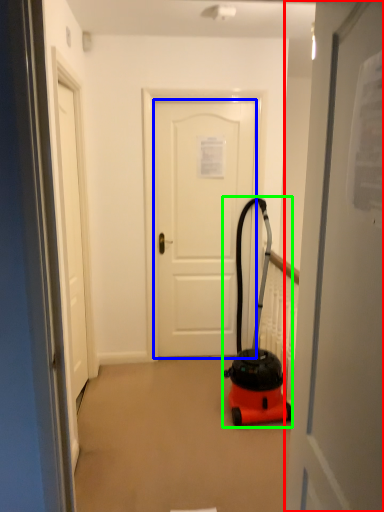
Question: Which is nearer to the door (highlighted by a red box)? door (highlighted by a blue box) or equipment (highlighted by a green box).

Choices:
 (A) door
 (B) equipment

Answer: (B)